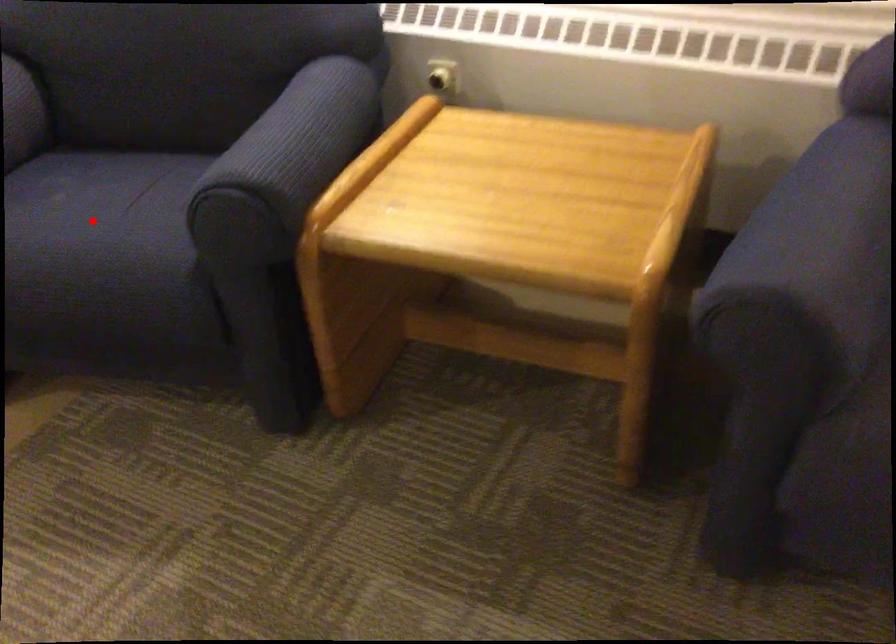
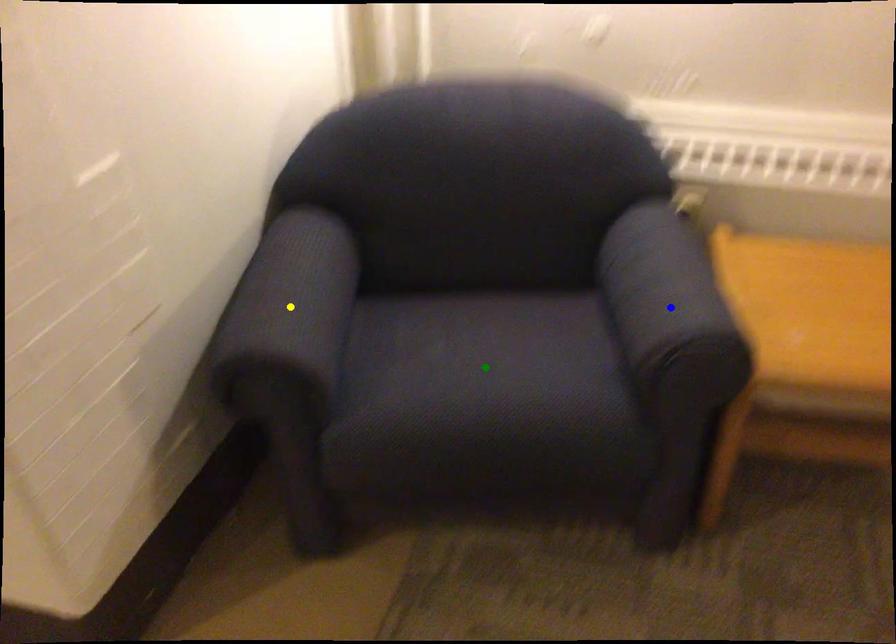
Question: I am providing you with two images of the same scene from different viewpoints. A red point is marked on the first image. You are given multiple points on the second image. Can you choose the point in image 2 that corresponds to the point in image 1?

Choices:
 (A) green point
 (B) yellow point
 (C) blue point

Answer: (A)